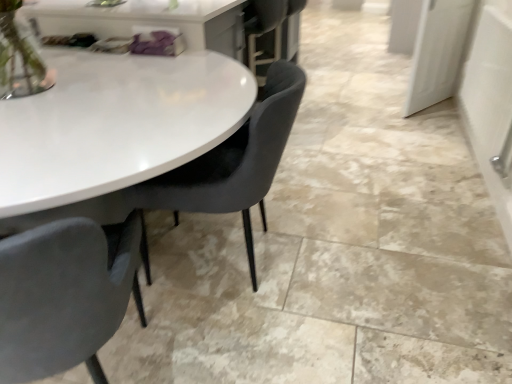
I want to click on free spot below white glossy door at upper right (from a real-world perspective), so click(421, 111).